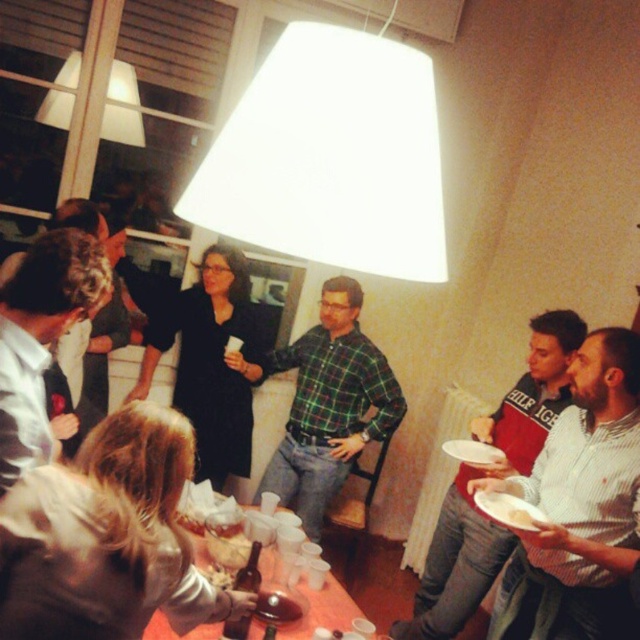
Question: Can you confirm if green plaid shirt at center is positioned below matte black plate at center?

Choices:
 (A) yes
 (B) no

Answer: (B)

Question: Among these objects, which one is nearest to the camera?

Choices:
 (A) white matte lampshade at upper center
 (B) green plaid shirt at center
 (C) striped cotton shirt at lower right

Answer: (A)

Question: Which is farther from the white striped shirt at lower right?

Choices:
 (A) white paper plate at lower right
 (B) white matte lampshade at upper center
 (C) translucent plastic cups at lower center

Answer: (B)

Question: Is striped cotton shirt at lower right further to camera compared to white shirt at center?

Choices:
 (A) yes
 (B) no

Answer: (A)

Question: Which point is farther to the camera?

Choices:
 (A) matte black plate at center
 (B) green plaid shirt at center

Answer: (A)

Question: Is green plaid shirt at center below matte black plate at center?

Choices:
 (A) no
 (B) yes

Answer: (A)